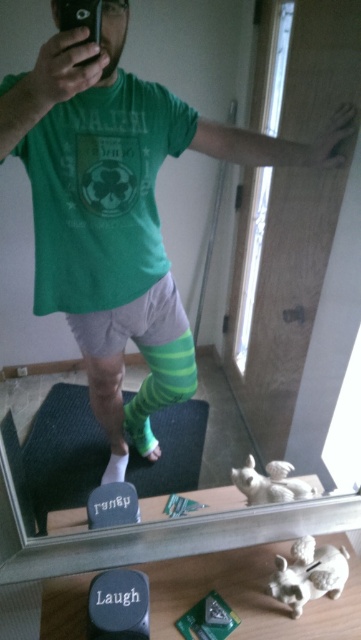
Which is behind, point (85, 42) or point (110, 465)?

The point (110, 465) is behind.

Describe the element at coordinates (80, 17) in the screenshot. I see `black plastic phone at upper left` at that location.

Does point (62, 19) come behind point (118, 477)?

That is False.

This screenshot has height=640, width=361. What are the coordinates of `black plastic phone at upper left` in the screenshot? It's located at (80, 17).

Does green knitted sock at lower center appear on the left side of green striped sock at lower left?

In fact, green knitted sock at lower center is to the right of green striped sock at lower left.

Is green knitted sock at lower center taller than green striped sock at lower left?

Yes.

Who is more forward, (149, 454) or (123, 477)?

Positioned in front is point (123, 477).

The image size is (361, 640). What are the coordinates of `green knitted sock at lower center` in the screenshot? It's located at (138, 428).

Between black plastic phone at upper left and green knitted sock at lower center, which one is positioned higher?

Positioned higher is black plastic phone at upper left.

Is black plastic phone at upper left taller than green knitted sock at lower center?

In fact, black plastic phone at upper left may be shorter than green knitted sock at lower center.

Measure the distance between point (90,32) and camera.

A distance of 35.22 inches exists between point (90,32) and camera.

Locate an element on the screen. black plastic phone at upper left is located at coordinates (80, 17).